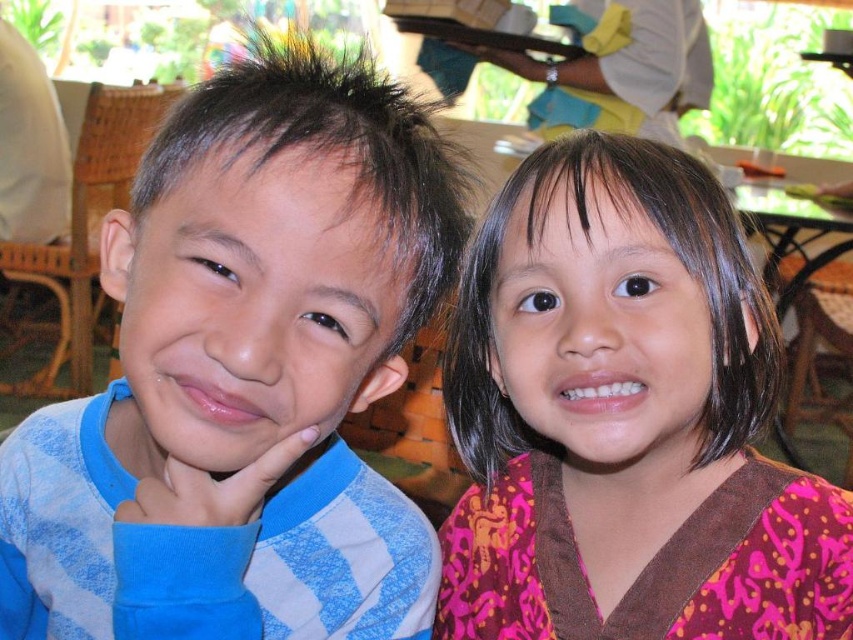
You are a photographer adjusting the lighting for a photo shoot. You notice the blue striped shirt at left and the white cloth at upper center in the scene. Which object should you adjust the lighting for to ensure it doesn not get overshadowed by the other?

The blue striped shirt at left has a lesser height compared to white cloth at upper center, so you should adjust the lighting for the blue striped shirt at left to ensure it doesn not get overshadowed by the taller white cloth at upper center.

You are a photographer trying to adjust the lighting for a photo shoot. You notice the blue striped shirt at left and the pink fabric at upper right. Which object requires more light adjustment to ensure proper exposure, considering their sizes?

The blue striped shirt at left has a smaller size compared to pink fabric at upper right, so it might require more focused lighting adjustments to ensure it is properly exposed given its smaller surface area.